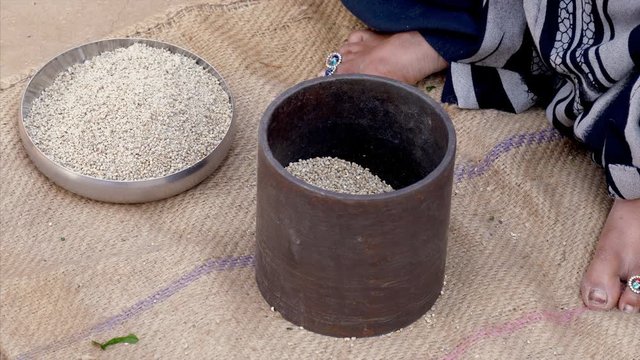
The image size is (640, 360). In order to click on canister in this screenshot , I will do `click(381, 226)`.